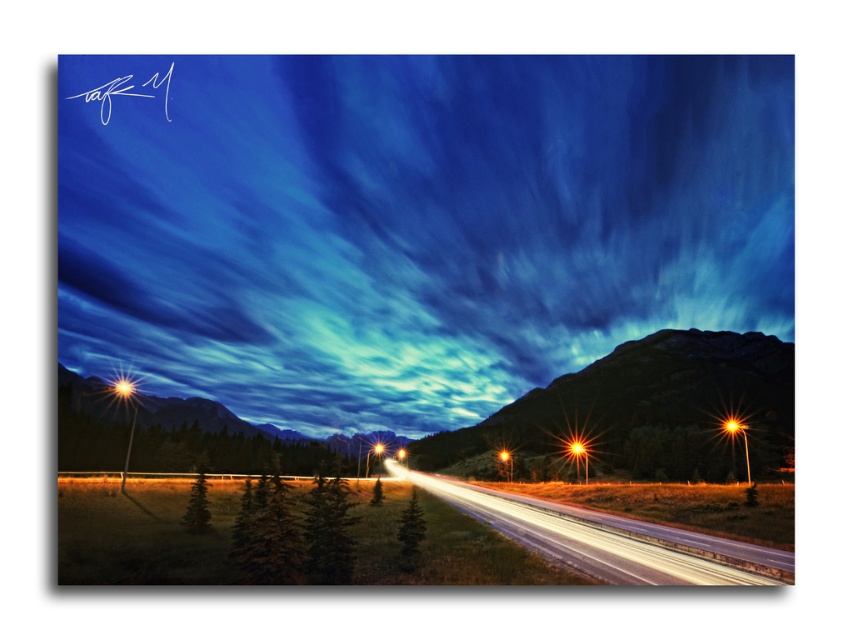
You are standing on the road in the image and want to walk towards the two points marked. Which point, point (444, 486) or point (583, 445), will you reach first?

You will reach point (444, 486) first because it is closer to you than point (583, 445).